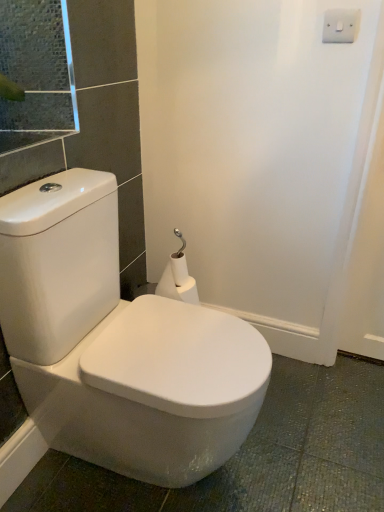
Question: Relative to white matte toilet paper at center, is white glossy toilet at center in front or behind?

Choices:
 (A) behind
 (B) front

Answer: (B)

Question: Is white glossy toilet at center spatially inside white matte toilet paper at center, or outside of it?

Choices:
 (A) outside
 (B) inside

Answer: (A)

Question: Which object is the farthest from the white matte toilet paper at center?

Choices:
 (A) white glossy toilet at center
 (B) white plastic/light switch at upper right

Answer: (B)

Question: Which is farther from the white plastic/light switch at upper right?

Choices:
 (A) white matte toilet paper at center
 (B) white glossy toilet at center

Answer: (B)